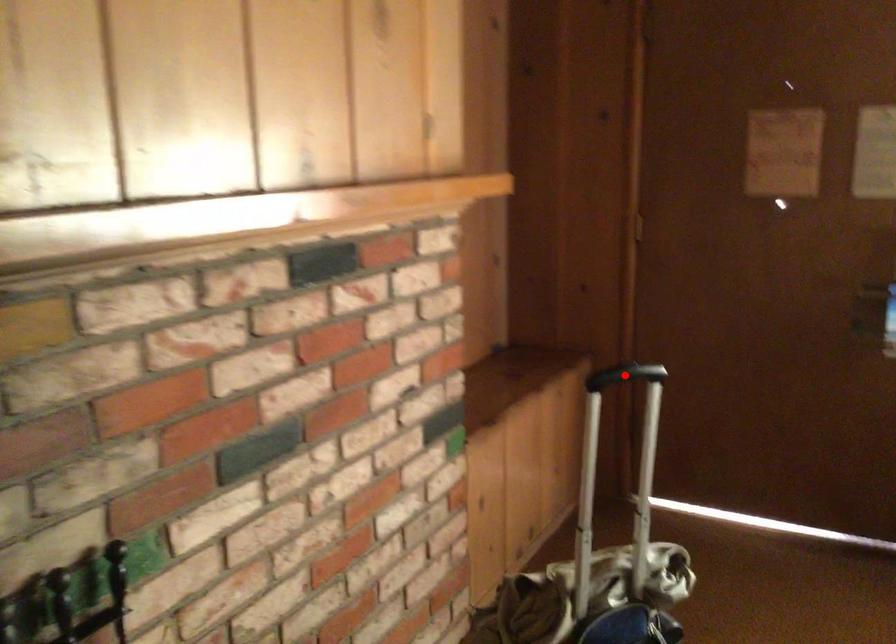
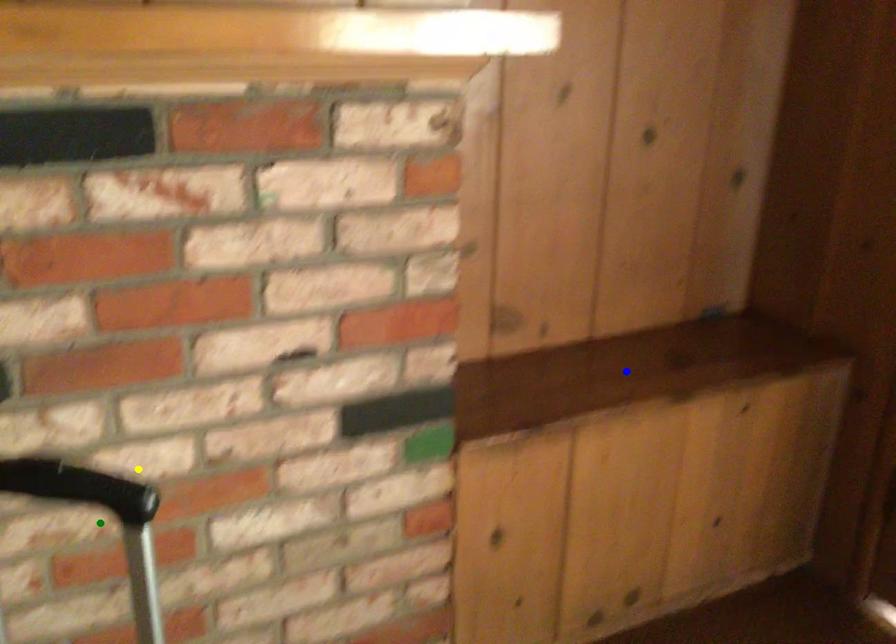
Question: I am providing you with two images of the same scene from different viewpoints. A red point is marked on the first image. You are given multiple points on the second image. In image 2, which mark is for the same physical point as the one in image 1?

Choices:
 (A) green point
 (B) yellow point
 (C) blue point

Answer: (B)